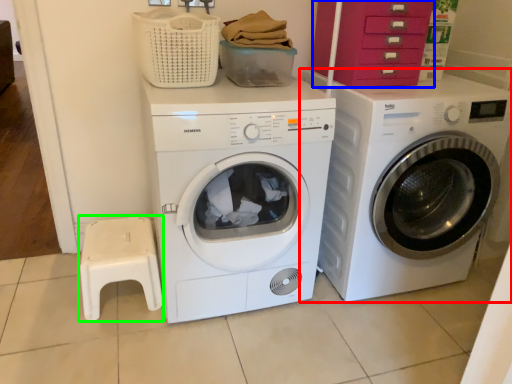
Question: Considering the real-world distances, which object is farthest from washing machine (highlighted by a red box)? drawer (highlighted by a blue box) or step stool (highlighted by a green box)?

Choices:
 (A) drawer
 (B) step stool

Answer: (B)